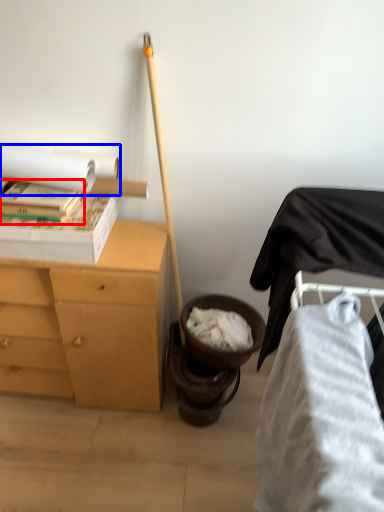
Question: Which object is closer to the camera taking this photo, book (highlighted by a red box) or toilet paper (highlighted by a blue box)?

Choices:
 (A) book
 (B) toilet paper

Answer: (B)